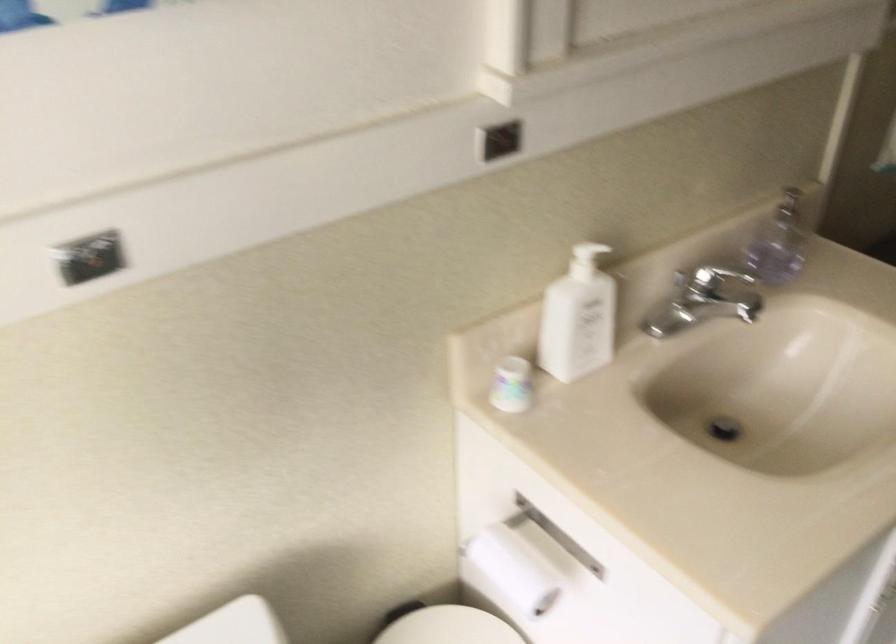
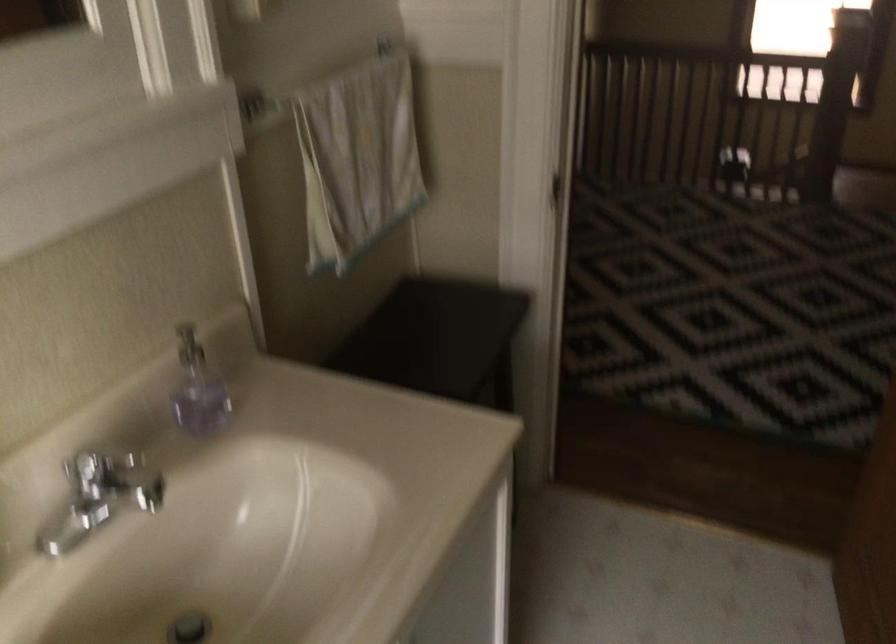
Question: The camera is either moving clockwise (left) or counter-clockwise (right) around the object. The first image is from the beginning of the video and the second image is from the end. Is the camera moving left or right when shooting the video?

Choices:
 (A) Left
 (B) Right

Answer: (A)